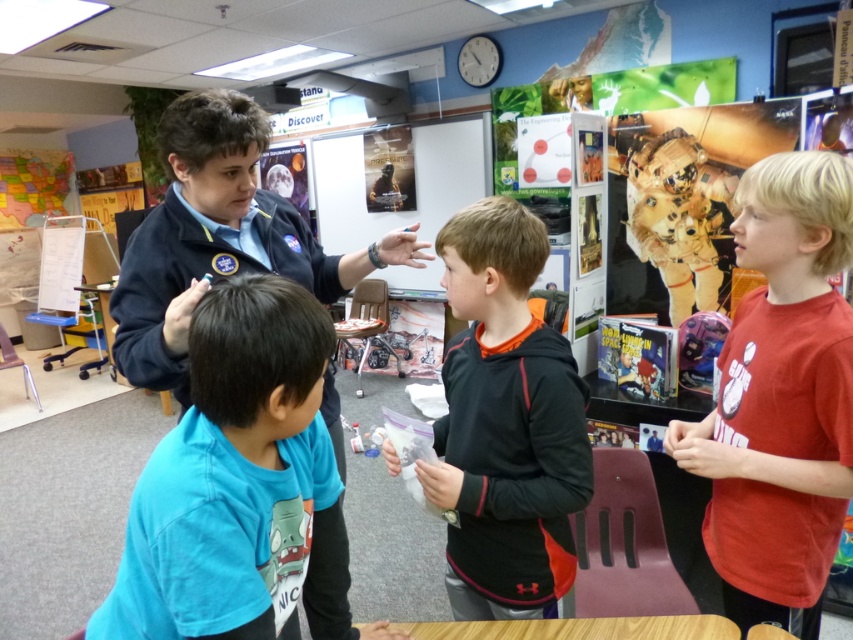
You are standing in the classroom and want to hand a note to the student wearing the black fleece hoodie at center. If you are facing the front of the classroom, which direction should you move to reach the student?

The black fleece hoodie at center is located at point coordinates 0.662 on the x axis and 0.593 on the y axis. Since the exact direction isn

You are a student in the classroom. You need to decide which item is narrower between the black fleece hoodie at center and the brown fabric astronaut at upper right. Which one is it?

The black fleece hoodie at center is thinner than the brown fabric astronaut at upper right, so the black fleece hoodie at center is narrower.

You are standing in the classroom and want to reach both the point at coordinates [564,390] and the point at [706,209]. Which point should you walk towards first if you want to reach the one closer to you first?

You should walk towards the point at coordinates [564,390] first because it is closer to you than the point at [706,209].